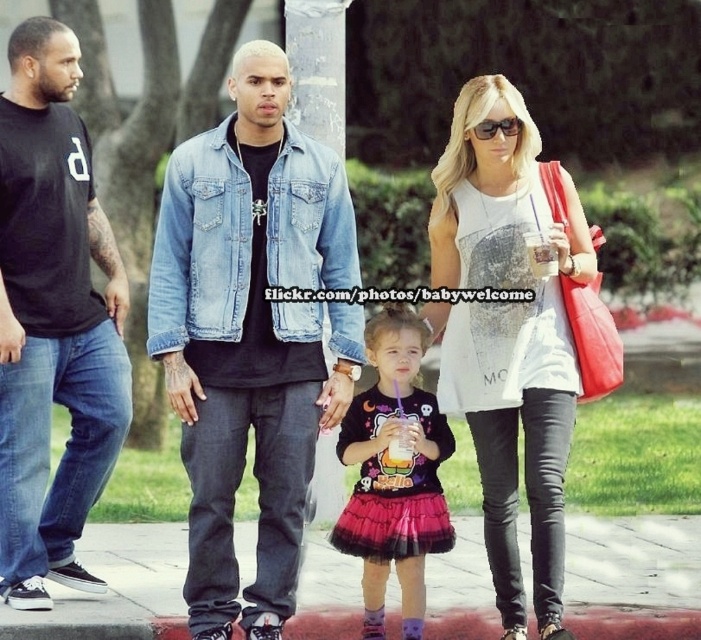
Question: Which object is the farthest from the sunglasses at center?

Choices:
 (A) black t-shirt at left
 (B) white matte tank top at upper right
 (C) black tulle skirt at center

Answer: (A)

Question: Among these points, which one is nearest to the camera?

Choices:
 (A) (261, 115)
 (B) (489, 118)
 (C) (411, 401)
 (D) (498, 566)

Answer: (C)

Question: Does concrete sidewalk at center appear on the left side of black tulle skirt at center?

Choices:
 (A) yes
 (B) no

Answer: (B)

Question: Can you confirm if black t-shirt at left is positioned above sunglasses at center?

Choices:
 (A) no
 (B) yes

Answer: (A)

Question: Which object appears farthest from the camera in this image?

Choices:
 (A) faded denim jacket at center
 (B) sunglasses at center

Answer: (A)

Question: Is black t-shirt at left to the right of black tulle skirt at center from the viewer's perspective?

Choices:
 (A) yes
 (B) no

Answer: (B)